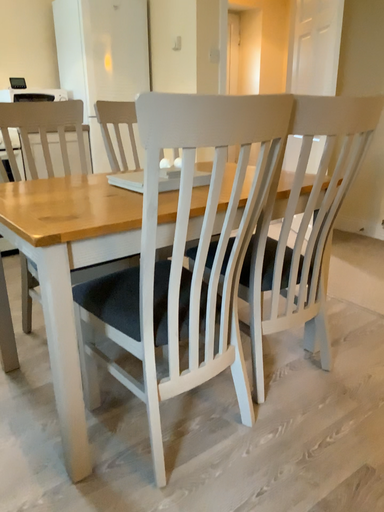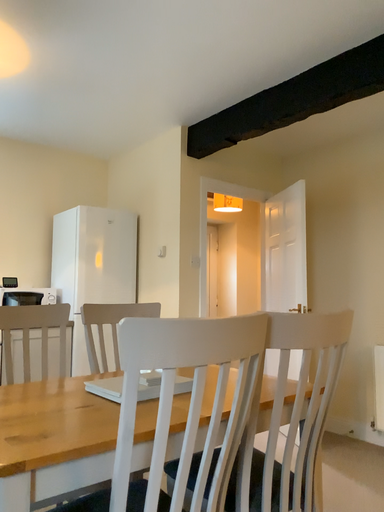
Question: Which way did the camera rotate in the video?

Choices:
 (A) rotated downward
 (B) rotated upward

Answer: (B)